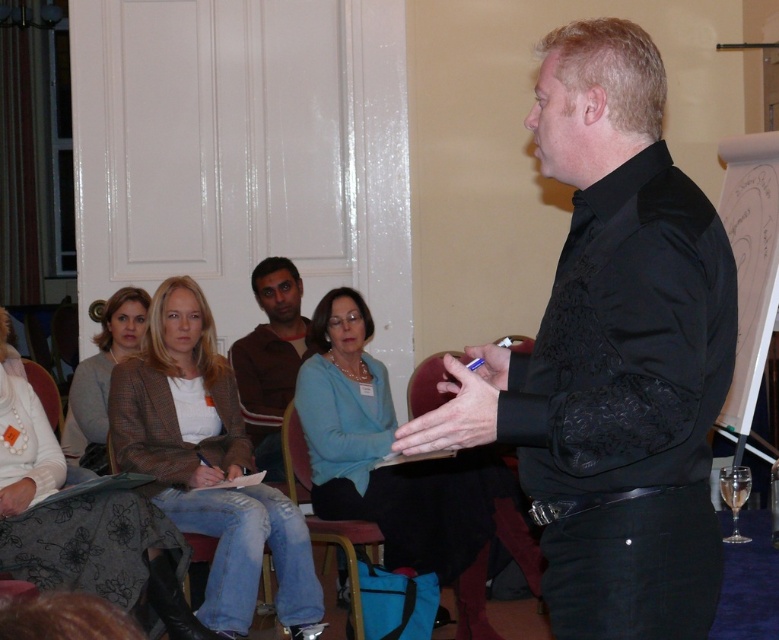
Between denim jeans at center and brown sweater at center, which one has more height?

denim jeans at center is taller.

Who is positioned more to the right, denim jeans at center or brown sweater at center?

Positioned to the right is brown sweater at center.

Between point (147, 429) and point (277, 266), which one is positioned in front?

Point (147, 429) is in front.

Locate an element on the screen. The width and height of the screenshot is (779, 640). denim jeans at center is located at coordinates (206, 464).

Does matte brown blazer at center have a smaller size compared to brown leather chair at lower center?

Correct, matte brown blazer at center occupies less space than brown leather chair at lower center.

Which of these two, matte brown blazer at center or brown leather chair at lower center, stands shorter?

With less height is matte brown blazer at center.

This screenshot has width=779, height=640. What are the coordinates of `matte brown blazer at center` in the screenshot? It's located at (104, 372).

The image size is (779, 640). I want to click on matte brown blazer at center, so pyautogui.click(x=104, y=372).

What do you see at coordinates (612, 356) in the screenshot?
I see `black satin shirt at center` at bounding box center [612, 356].

Between point (455, 417) and point (321, 532), which one is positioned behind?

The point (321, 532) is more distant.

Consider the image. Who is more forward, (541, 48) or (347, 618)?

Point (541, 48)

This screenshot has height=640, width=779. In order to click on black satin shirt at center in this screenshot , I will do `click(612, 356)`.